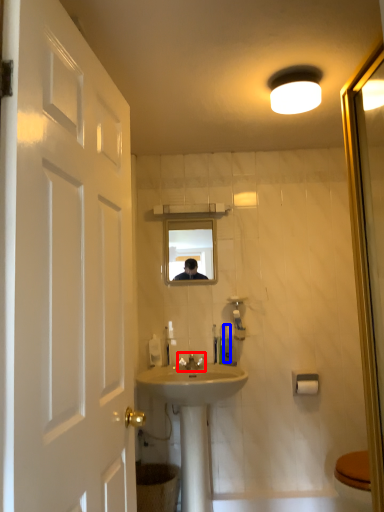
Question: Which object is further to the camera taking this photo, tap (highlighted by a red box) or toiletry (highlighted by a blue box)?

Choices:
 (A) tap
 (B) toiletry

Answer: (B)